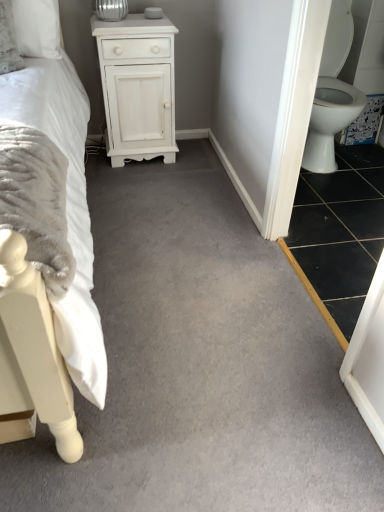
Question: Which is correct: white matte cabinet at upper center is inside black tile at lower right, or outside of it?

Choices:
 (A) inside
 (B) outside

Answer: (B)

Question: From the image's perspective, is white matte cabinet at upper center positioned above or below black tile at lower right?

Choices:
 (A) above
 (B) below

Answer: (A)

Question: Based on their relative distances, which object is farther from the white soft bed at left?

Choices:
 (A) white glossy toilet at right
 (B) white matte cabinet at upper center
 (C) black tile at lower right

Answer: (A)

Question: Considering the real-world distances, which object is farthest from the black tile at lower right?

Choices:
 (A) white matte cabinet at upper center
 (B) white soft bed at left
 (C) white glossy toilet at right

Answer: (B)